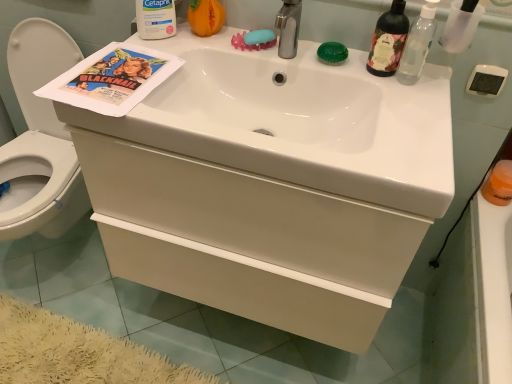
You are a GUI agent. You are given a task and a screenshot of the screen. Output one action in this format:
    pyautogui.click(x=<x>, y=<y>)
    Task: Click on the vacant space in matte paper poster at upper left (from a real-world perspective)
    The width and height of the screenshot is (512, 384).
    Given the screenshot: What is the action you would take?
    pyautogui.click(x=117, y=76)